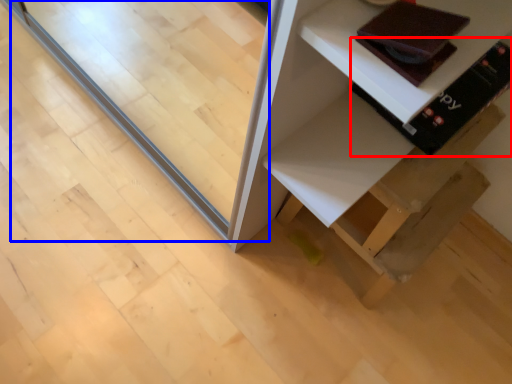
Question: Which object is closer to the camera taking this photo, book (highlighted by a red box) or glass door (highlighted by a blue box)?

Choices:
 (A) book
 (B) glass door

Answer: (B)